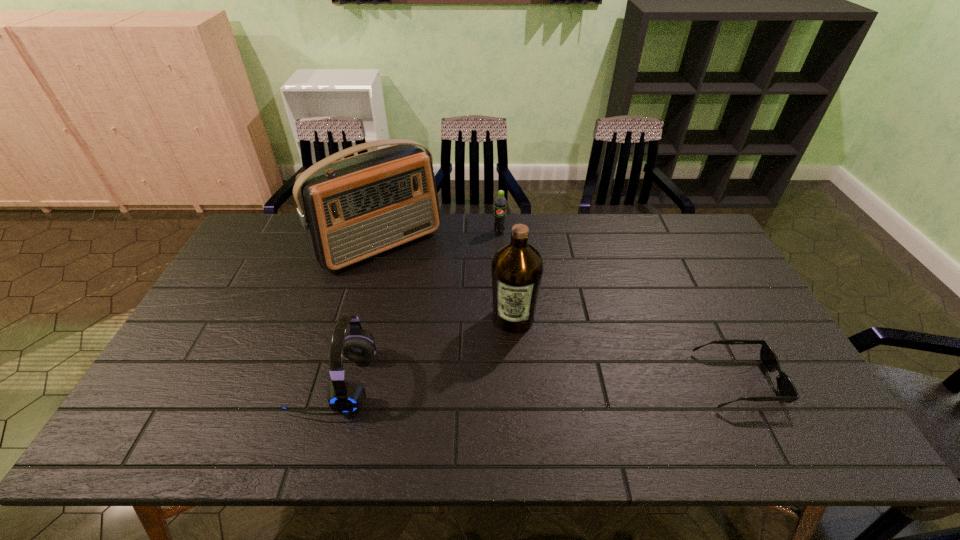
Find the location of a particular element. This screenshot has height=540, width=960. vacant point located between the fourth tallest object and the radio receiver is located at coordinates (440, 238).

Image resolution: width=960 pixels, height=540 pixels. I want to click on vacant space that is in between the rightmost object and the soda, so click(619, 306).

This screenshot has width=960, height=540. Identify the location of unoccupied area between the sunglasses and the second shortest object. (619, 306).

The height and width of the screenshot is (540, 960). In order to click on vacant area between the soda and the third tallest object in this screenshot , I will do `click(417, 307)`.

Identify the location of empty location between the radio receiver and the soda. This screenshot has height=540, width=960. (440, 238).

This screenshot has height=540, width=960. I want to click on free space that is in between the shortest object and the radio receiver, so coord(559,312).

The image size is (960, 540). Identify the location of free spot between the radio receiver and the third tallest object. (357, 313).

Image resolution: width=960 pixels, height=540 pixels. Identify the location of vacant point located between the radio receiver and the third farthest object. (446, 280).

The width and height of the screenshot is (960, 540). I want to click on object that is the nearest to the headset, so click(352, 209).

What are the coordinates of `the fourth closest object relative to the soda` in the screenshot? It's located at (788, 393).